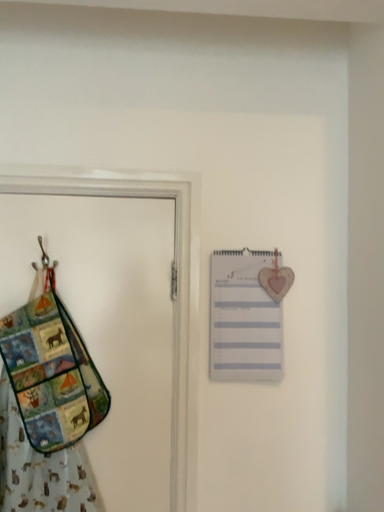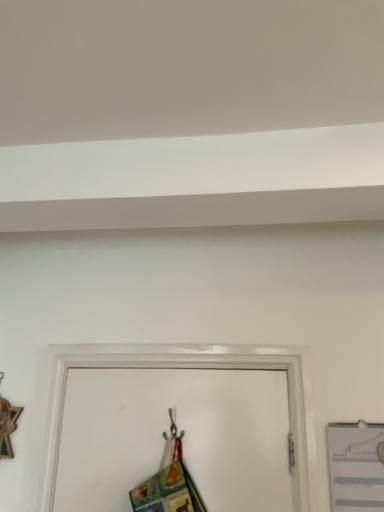
Question: How did the camera likely rotate when shooting the video?

Choices:
 (A) rotated downward
 (B) rotated upward

Answer: (B)